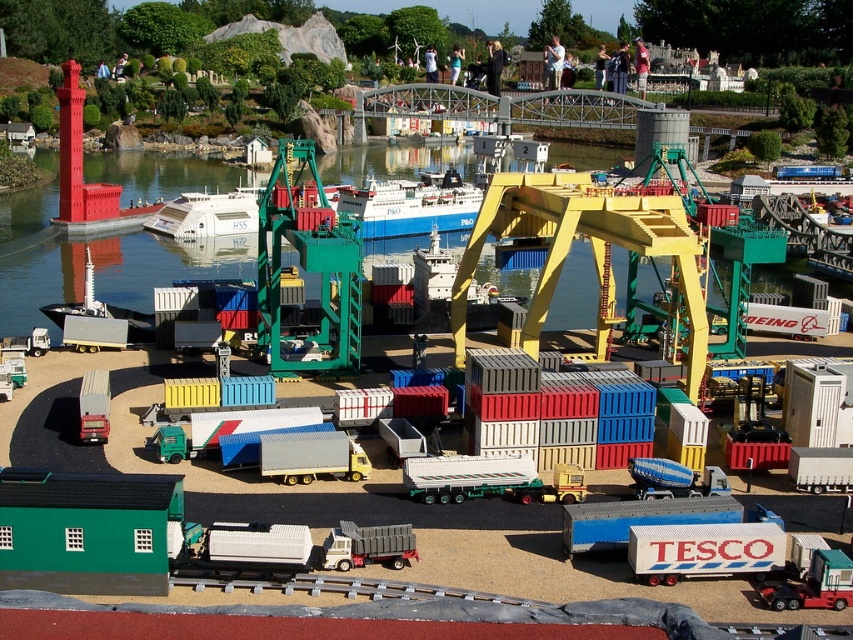
Where is the white glossy ship at center located in the image?

The white glossy ship at center is located at point coordinates of (207, 214).

You are a toy designer examining the miniature port scene. You need to determine which object, the blue matte container ship at center or the metallic silver truck at center, would require more space for packaging and shipping. Based on the scene, which one would you choose?

The blue matte container ship at center is larger in size than the metallic silver truck at center, so it would require more space for packaging and shipping.